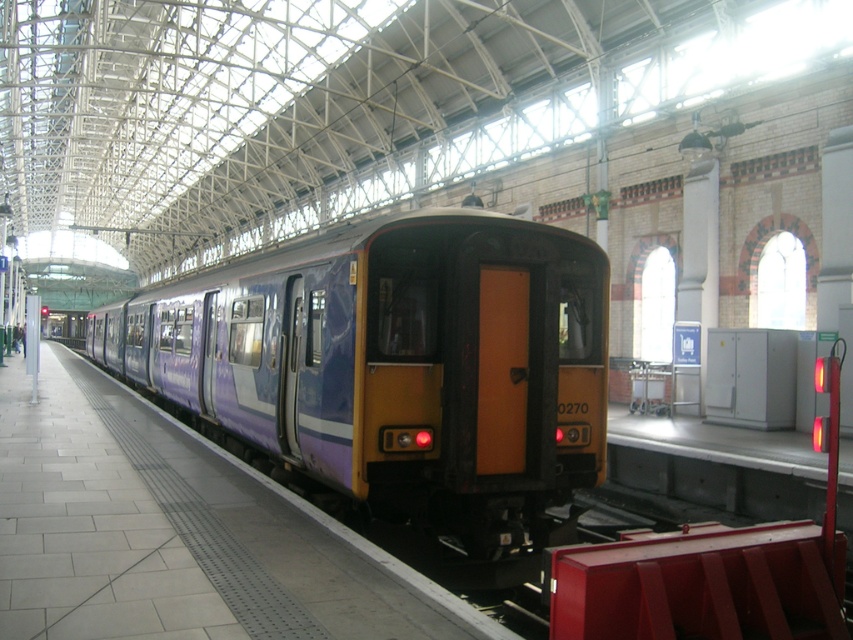
Question: Can you confirm if purple matte train at center is positioned above purple glossy platform at center?

Choices:
 (A) yes
 (B) no

Answer: (A)

Question: Does purple matte train at center lie in front of purple glossy platform at center?

Choices:
 (A) no
 (B) yes

Answer: (A)

Question: Can you confirm if purple matte train at center is positioned above purple glossy platform at center?

Choices:
 (A) yes
 (B) no

Answer: (A)

Question: Among these objects, which one is farthest from the camera?

Choices:
 (A) purple glossy platform at center
 (B) purple matte train at center

Answer: (B)

Question: Which of the following is the farthest from the observer?

Choices:
 (A) (399, 371)
 (B) (350, 592)

Answer: (A)